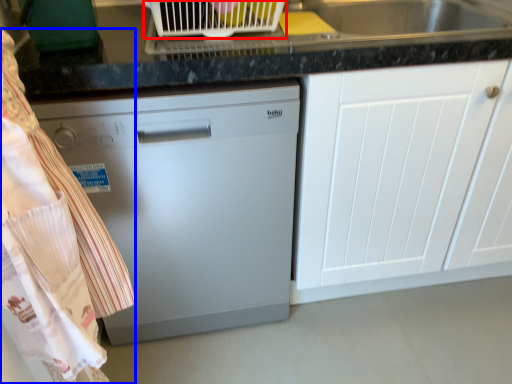
Question: Which object is further to the camera taking this photo, appliance (highlighted by a red box) or laundry (highlighted by a blue box)?

Choices:
 (A) appliance
 (B) laundry

Answer: (A)